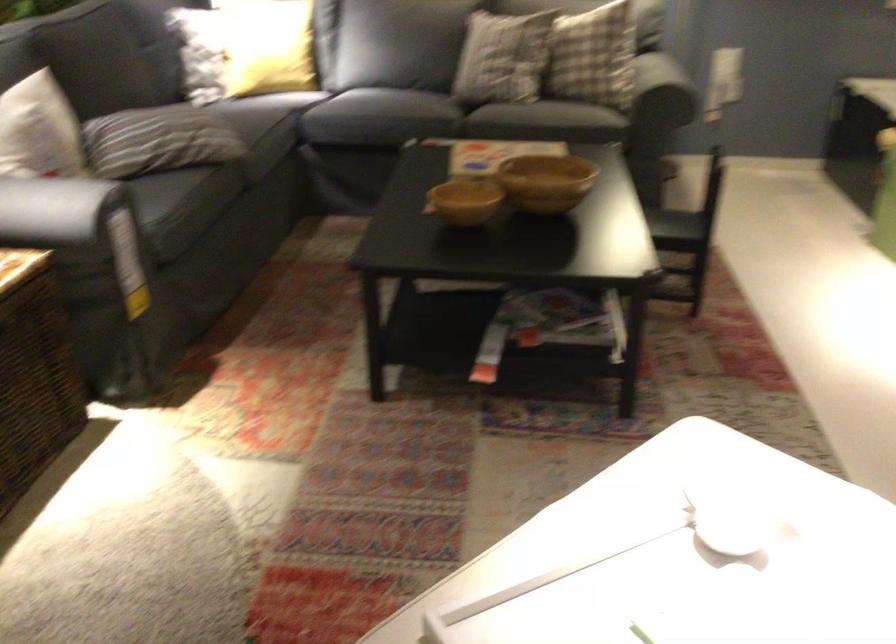
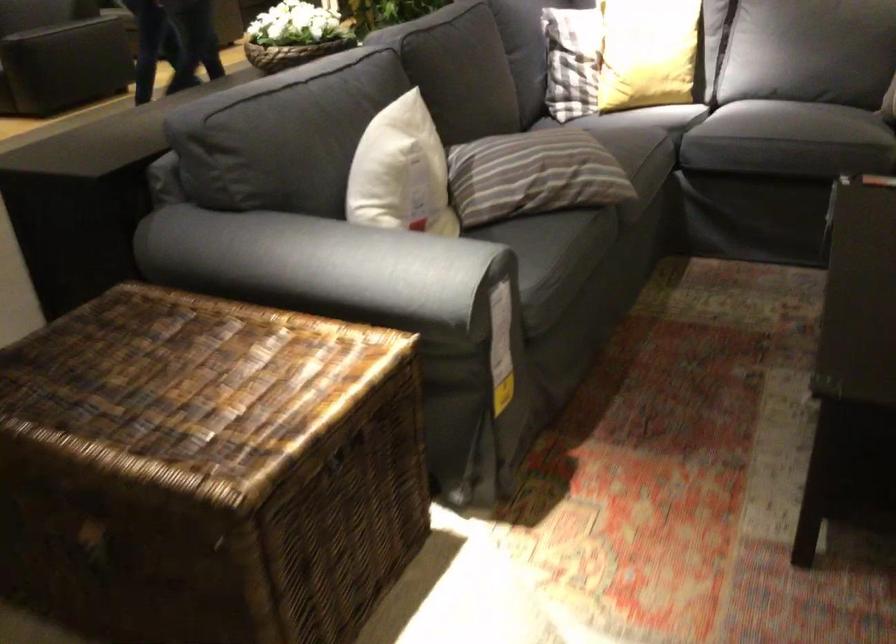
Question: The camera is either moving clockwise (left) or counter-clockwise (right) around the object. The first image is from the beginning of the video and the second image is from the end. Is the camera moving left or right when shooting the video?

Choices:
 (A) Left
 (B) Right

Answer: (B)